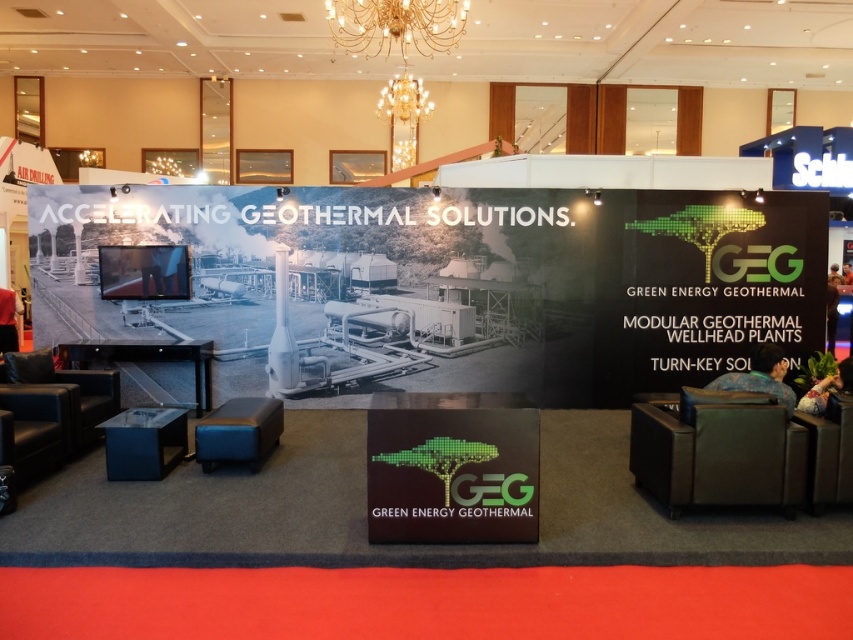
Question: Which point is closer to the camera?

Choices:
 (A) leather armchair at lower left
 (B) brown leather chair at center

Answer: (A)

Question: Among these points, which one is farthest from the camera?

Choices:
 (A) (28, 403)
 (B) (822, 401)
 (C) (430, 106)

Answer: (C)

Question: Does matte black armchair at lower right have a lesser width compared to black leather armchair at lower left?

Choices:
 (A) no
 (B) yes

Answer: (A)

Question: Among these points, which one is farthest from the camera?

Choices:
 (A) tap(407, 540)
 (B) tap(846, 276)
 (C) tap(828, 275)
 (D) tap(387, 109)

Answer: (D)

Question: Does gold crystal chandelier at upper center appear on the right side of green fabric chair at lower right?

Choices:
 (A) no
 (B) yes

Answer: (A)

Question: Is gold metallic chandelier at upper center behind green floral dress at center?

Choices:
 (A) yes
 (B) no

Answer: (A)